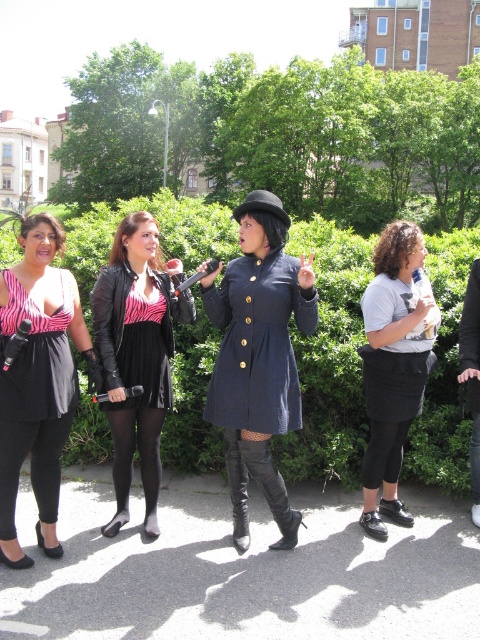
Does matte navy coat at center have a lesser width compared to white cotton shirt at center?

No, matte navy coat at center is not thinner than white cotton shirt at center.

Between matte navy coat at center and white cotton shirt at center, which one is positioned lower?

Positioned lower is white cotton shirt at center.

Where is `matte navy coat at center`? This screenshot has height=640, width=480. matte navy coat at center is located at coordinates (259, 356).

Locate an element on the screen. matte navy coat at center is located at coordinates (259, 356).

Who is positioned more to the right, matte black dress at left or leather jacket at center?

Positioned to the right is leather jacket at center.

Between point (40, 344) and point (128, 515), which one is positioned behind?

The point (128, 515) is behind.

Does point (28, 419) come farther from viewer compared to point (131, 449)?

No.

This screenshot has height=640, width=480. I want to click on matte black dress at left, so click(x=37, y=380).

How far apart are green leafy hedge at center and leather boots at center?

They are 5.43 feet apart.

Does green leafy hedge at center appear on the right side of leather boots at center?

Correct, you'll find green leafy hedge at center to the right of leather boots at center.

Between point (328, 372) and point (273, 496), which one is positioned in front?

Point (273, 496) is more forward.

The height and width of the screenshot is (640, 480). In order to click on green leafy hedge at center in this screenshot , I will do `click(330, 358)`.